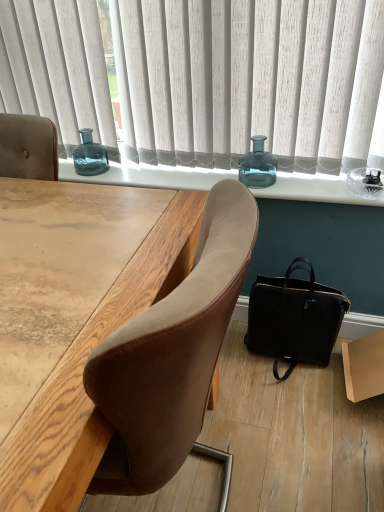
I want to click on vacant space situated above wooden desk at center (from a real-world perspective), so click(67, 240).